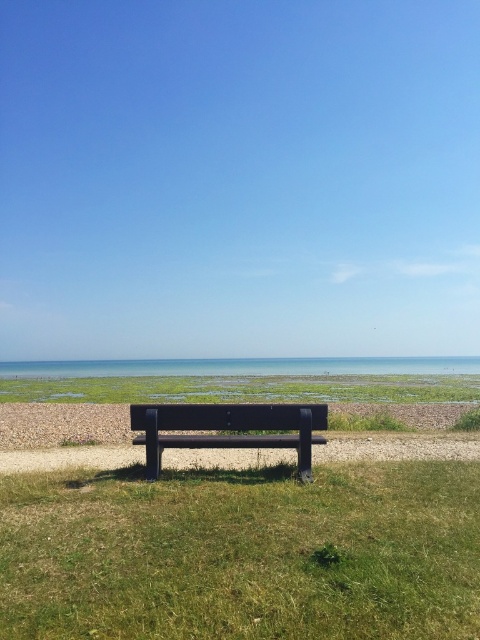
You are standing at the edge of the grass near the matte black bench at center and want to walk to the blue water at center. Which direction should you move relative to the bench?

The matte black bench at center is to the left of the blue water at center, so you should move to the right of the bench to reach the water.

You are standing at the edge of the grassy area and want to sit on the matte black bench at center. Is the bench located below or above the green grass at center?

The matte black bench at center is located below the green grass at center, so you can sit on it by moving downward from the grass.

You are standing on the wooden bench and want to walk to the blue water at center. Which direction should you move relative to the green grass at center?

You should move to the right of the green grass at center to reach the blue water at center since the green grass at center is located to the left of the blue water at center.